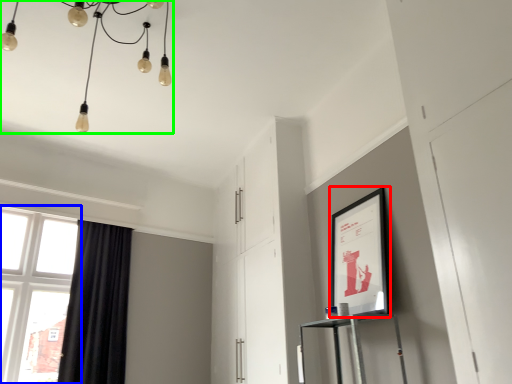
Question: Estimate the real-world distances between objects in this image. Which object is farther from picture frame (highlighted by a red box), window (highlighted by a blue box) or lamp (highlighted by a green box)?

Choices:
 (A) window
 (B) lamp

Answer: (A)